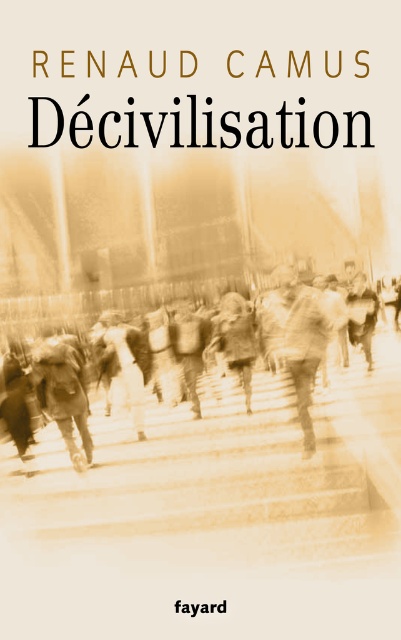
Question: Can you confirm if sepia stone stairs at center is positioned to the right of sepia textured crowd at center?

Choices:
 (A) yes
 (B) no

Answer: (B)

Question: Which point is closer to the camera taking this photo?

Choices:
 (A) (202, 445)
 (B) (392, 413)

Answer: (A)

Question: Among these objects, which one is nearest to the camera?

Choices:
 (A) sepia textured crowd at center
 (B) sepia stone stairs at center

Answer: (B)

Question: Where is sepia stone stairs at center located in relation to sepia textured crowd at center in the image?

Choices:
 (A) right
 (B) left

Answer: (B)

Question: Is sepia stone stairs at center further to camera compared to sepia textured crowd at center?

Choices:
 (A) no
 (B) yes

Answer: (A)